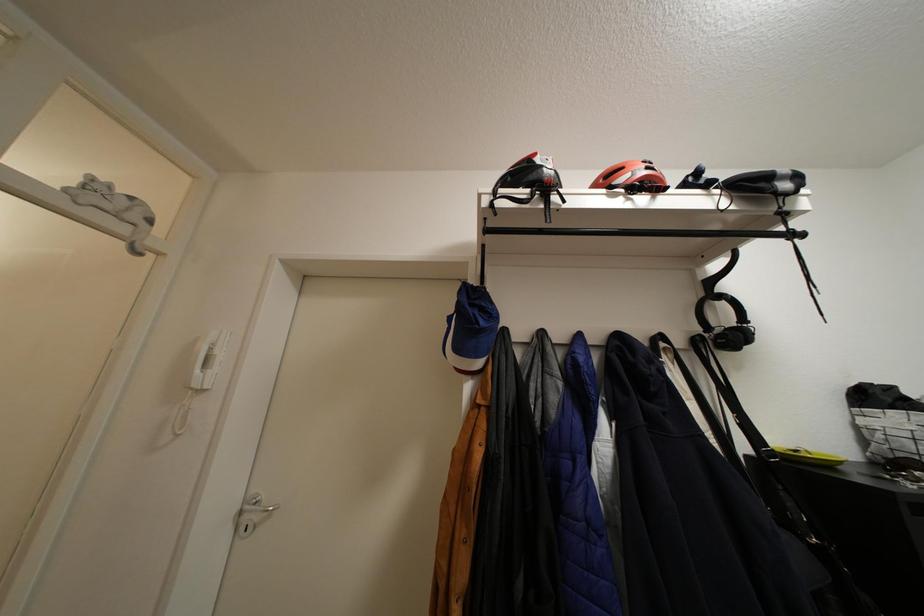
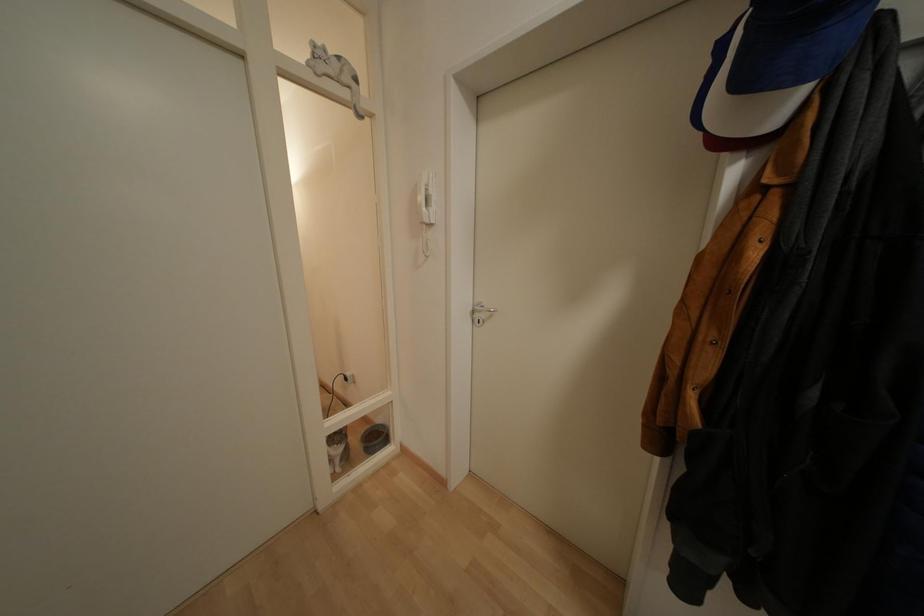
The images are taken continuously from a first-person perspective. In which direction is your viewpoint rotating?

The rotation direction of the camera is left-down.